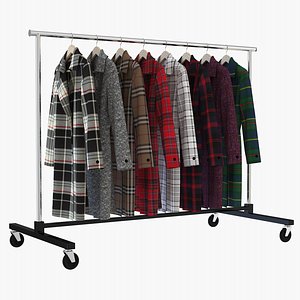
At what (x,y) coordinates should I click in order to perform the action: click on hangers. Please return your answer as a coordinate pair (x, y). Looking at the image, I should click on (67, 51), (95, 47), (117, 52), (138, 54), (160, 54), (184, 52), (207, 55), (222, 55).